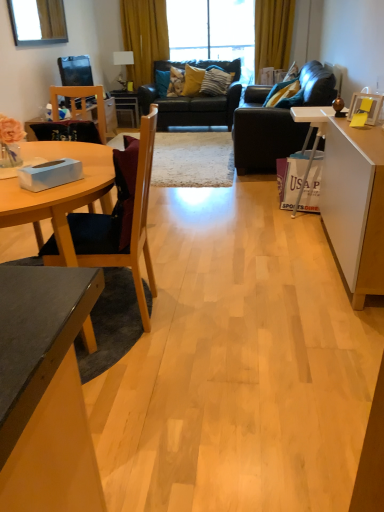
Find the location of a particular element. The width and height of the screenshot is (384, 512). free space to the right of wooden chair at left, arranged as the 2th chair when viewed from the top is located at coordinates (213, 306).